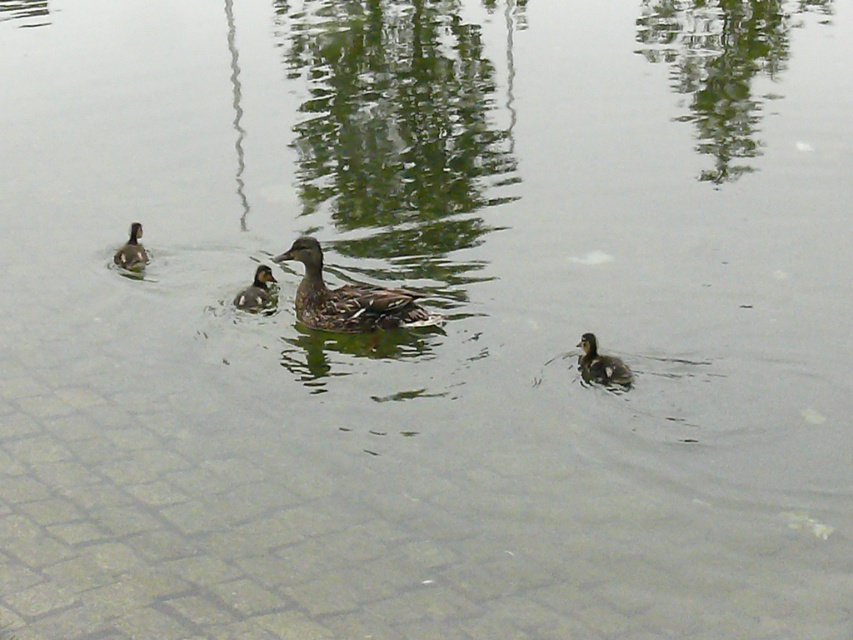
Can you confirm if brown speckled duckling at center is positioned below brown matte duckling at left?

Correct, brown speckled duckling at center is located below brown matte duckling at left.

Who is higher up, brown speckled duckling at center or brown matte duckling at left?

Positioned higher is brown matte duckling at left.

Describe the element at coordinates (347, 298) in the screenshot. I see `brown speckled duckling at center` at that location.

Locate an element on the screen. This screenshot has height=640, width=853. brown speckled duckling at center is located at coordinates (347, 298).

Can you confirm if brown fuzzy duckling at right is bigger than brown matte duckling at center?

Incorrect, brown fuzzy duckling at right is not larger than brown matte duckling at center.

Which is in front, point (607, 362) or point (256, 304)?

Positioned in front is point (607, 362).

Who is more forward, (605, 356) or (253, 292)?

Point (605, 356) is more forward.

Find the location of `brown fuzzy duckling at right`. brown fuzzy duckling at right is located at coordinates (x=601, y=364).

Is brown fuzzy duckling at right wider than brown matte duckling at left?

In fact, brown fuzzy duckling at right might be narrower than brown matte duckling at left.

Who is more distant from viewer, (581, 356) or (138, 264)?

The point (138, 264) is more distant.

Does point (587, 337) come closer to viewer compared to point (140, 262)?

Yes.

The width and height of the screenshot is (853, 640). What are the coordinates of `brown fuzzy duckling at right` in the screenshot? It's located at (601, 364).